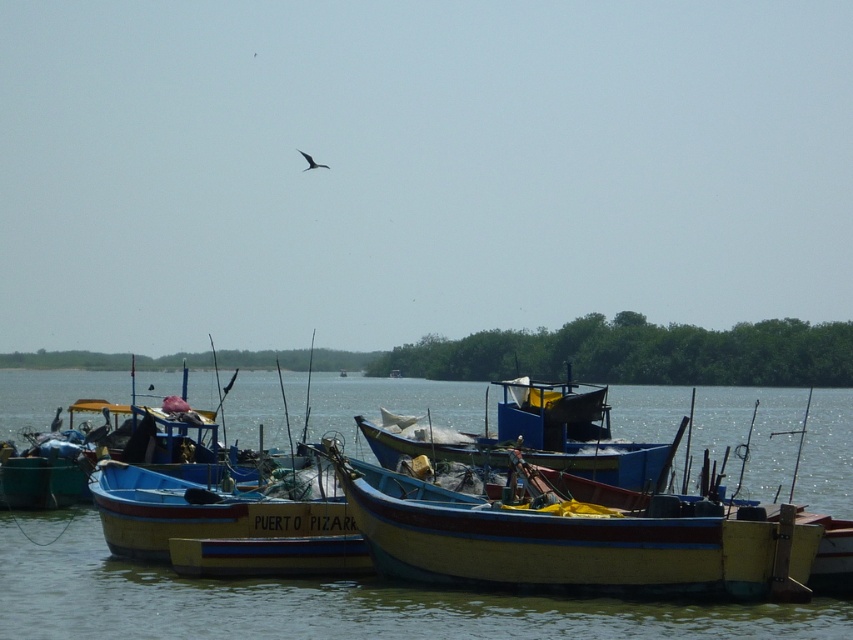
Question: Among these points, which one is nearest to the camera?

Choices:
 (A) (308, 156)
 (B) (729, 456)
 (C) (541, 548)
 (D) (236, 540)

Answer: (C)

Question: Does wooden boat at center appear on the left side of dark gray feathered bird at upper center?

Choices:
 (A) yes
 (B) no

Answer: (B)

Question: Estimate the real-world distances between objects in this image. Which object is farther from the wooden blue boat at center?

Choices:
 (A) smooth water at center
 (B) dark gray feathered bird at upper center
 (C) blue painted wood boat at center

Answer: (B)

Question: Is smooth water at center above wooden boat at center?

Choices:
 (A) yes
 (B) no

Answer: (B)

Question: Which point is farther to the camera?

Choices:
 (A) (579, 468)
 (B) (306, 157)
 (C) (566, 588)

Answer: (B)

Question: Is smooth water at center positioned at the back of dark gray feathered bird at upper center?

Choices:
 (A) no
 (B) yes

Answer: (A)